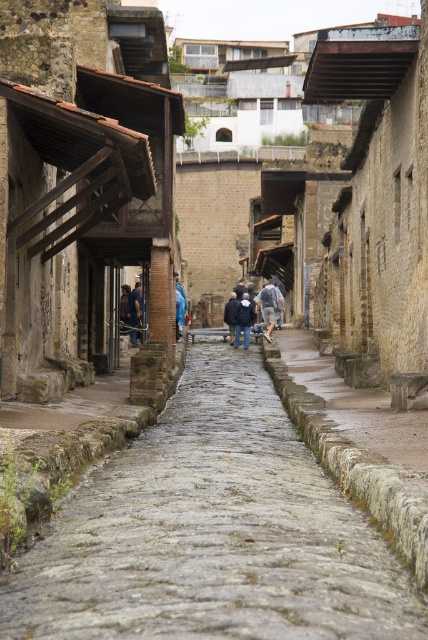
You are a tourist walking along the ancient street and want to step onto the gray stone pavement at center and the stone cobblestone path at center. Which one is located to the left side of the other?

The gray stone pavement at center is to the left of the stone cobblestone path at center.